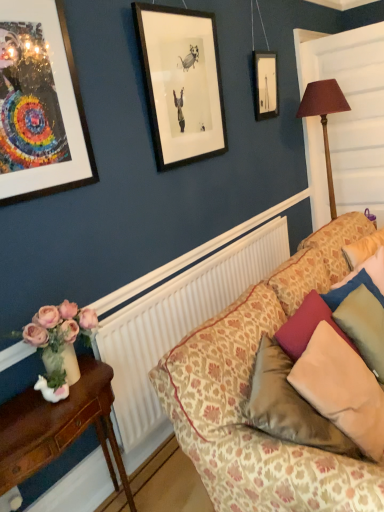
What do you see at coordinates (289, 405) in the screenshot?
I see `velvet beige pillow at lower right, arranged as the first pillow when viewed from the left` at bounding box center [289, 405].

Describe the element at coordinates (58, 426) in the screenshot. I see `brown wooden table at lower left` at that location.

At what (x,y) coordinates should I click in order to perform the action: click on metallic gold picture frame at upper left. Please return your answer as a coordinate pair (x, y). The width and height of the screenshot is (384, 512). Looking at the image, I should click on (40, 106).

The height and width of the screenshot is (512, 384). What do you see at coordinates (249, 396) in the screenshot?
I see `patterned fabric couch at lower right` at bounding box center [249, 396].

Describe the element at coordinates (178, 321) in the screenshot. The image size is (384, 512). I see `white textured radiator at center` at that location.

The height and width of the screenshot is (512, 384). In order to click on velvet green pillow at right, which is the second pillow from left to right in this screenshot , I will do `click(364, 326)`.

Is there a large distance between velvet beige pillow at lower right, the second pillow viewed from the right, and velvet green pillow at right, which is the second pillow from left to right?

Actually, velvet beige pillow at lower right, the second pillow viewed from the right, and velvet green pillow at right, which is the second pillow from left to right, are a little close together.

Looking at the image, does velvet beige pillow at lower right, the second pillow viewed from the right, seem bigger or smaller compared to velvet green pillow at right, which appears as the first pillow when viewed from the right?

Clearly, velvet beige pillow at lower right, the second pillow viewed from the right, is larger in size than velvet green pillow at right, which appears as the first pillow when viewed from the right.

Consider the image. What's the angular difference between velvet beige pillow at lower right, the second pillow viewed from the right, and velvet green pillow at right, which appears as the first pillow when viewed from the right,'s facing directions?

25.5 degrees separate the facing orientations of velvet beige pillow at lower right, the second pillow viewed from the right, and velvet green pillow at right, which appears as the first pillow when viewed from the right.

From a real-world perspective, which is physically above, velvet beige pillow at lower right, the second pillow viewed from the right, or velvet green pillow at right, which appears as the first pillow when viewed from the right?

velvet beige pillow at lower right, the second pillow viewed from the right.

Between brown fabric lampshade at right and velvet beige pillow at lower right, arranged as the first pillow when viewed from the left, which one appears on the right side from the viewer's perspective?

From the viewer's perspective, brown fabric lampshade at right appears more on the right side.

From the image's perspective, who appears lower, brown fabric lampshade at right or velvet beige pillow at lower right, the second pillow viewed from the right?

velvet beige pillow at lower right, the second pillow viewed from the right, is shown below in the image.

Is brown fabric lampshade at right further to camera compared to velvet beige pillow at lower right, arranged as the first pillow when viewed from the left?

Yes.

Is patterned fabric couch at lower right not close to brown wooden table at lower left?

No, there isn't a large distance between patterned fabric couch at lower right and brown wooden table at lower left.

Is patterned fabric couch at lower right closer to camera compared to brown wooden table at lower left?

Yes, it is in front of brown wooden table at lower left.

Which object is positioned more to the left, patterned fabric couch at lower right or brown wooden table at lower left?

brown wooden table at lower left is more to the left.

At what (x,y) coordinates should I click in order to perform the action: click on table located on the left of patterned fabric couch at lower right. Please return your answer as a coordinate pair (x, y). Looking at the image, I should click on (58, 426).

Is point (380, 485) closer or farther from the camera than point (378, 365)?

Point (380, 485) appears to be closer to the viewer than point (378, 365).

Is patterned fabric couch at lower right to the left of velvet green pillow at right, which is the second pillow from left to right, from the viewer's perspective?

Correct, you'll find patterned fabric couch at lower right to the left of velvet green pillow at right, which is the second pillow from left to right.

Does patterned fabric couch at lower right have a larger size compared to velvet green pillow at right, which appears as the first pillow when viewed from the right?

Indeed, patterned fabric couch at lower right has a larger size compared to velvet green pillow at right, which appears as the first pillow when viewed from the right.

How many degrees apart are the facing directions of patterned fabric couch at lower right and velvet green pillow at right, which is the second pillow from left to right?

There is a 0.000631-degree angle between the facing directions of patterned fabric couch at lower right and velvet green pillow at right, which is the second pillow from left to right.

Which is behind, point (193, 359) or point (264, 275)?

The point (264, 275) is farther.

Is patterned fabric couch at lower right facing towards white textured radiator at center?

Yes, patterned fabric couch at lower right faces towards white textured radiator at center.

This screenshot has width=384, height=512. In order to click on studio couch that appears below the white textured radiator at center (from the image's perspective) in this screenshot , I will do `click(249, 396)`.

Is patterned fabric couch at lower right completely or partially outside of white textured radiator at center?

patterned fabric couch at lower right lies outside white textured radiator at center's area.

From the image's perspective, which one is positioned lower, white textured radiator at center or metallic gold picture frame at upper left?

white textured radiator at center.

Considering the relative sizes of white textured radiator at center and metallic gold picture frame at upper left in the image provided, is white textured radiator at center taller than metallic gold picture frame at upper left?

Indeed, white textured radiator at center has a greater height compared to metallic gold picture frame at upper left.

Is white textured radiator at center to the left or to the right of metallic gold picture frame at upper left in the image?

Based on their positions, white textured radiator at center is located to the right of metallic gold picture frame at upper left.

Considering the sizes of objects white textured radiator at center and metallic gold picture frame at upper left in the image provided, who is smaller, white textured radiator at center or metallic gold picture frame at upper left?

Smaller between the two is metallic gold picture frame at upper left.

Consider the image. From their relative heights in the image, would you say metallic gold picture frame at upper left is taller or shorter than brown wooden table at lower left?

metallic gold picture frame at upper left is taller than brown wooden table at lower left.

Who is bigger, metallic gold picture frame at upper left or brown wooden table at lower left?

Bigger between the two is brown wooden table at lower left.

Is metallic gold picture frame at upper left positioned before brown wooden table at lower left?

No, metallic gold picture frame at upper left is further to the viewer.

You are a GUI agent. You are given a task and a screenshot of the screen. Output one action in this format:
    pyautogui.click(x=<x>, y=<y>)
    Task: Click on the table below the metallic gold picture frame at upper left (from a real-world perspective)
    The width and height of the screenshot is (384, 512).
    Given the screenshot: What is the action you would take?
    pyautogui.click(x=58, y=426)

The image size is (384, 512). Find the location of `pillow positioned vertically above the velvet green pillow at right, which appears as the first pillow when viewed from the right (from a real-world perspective)`. pillow positioned vertically above the velvet green pillow at right, which appears as the first pillow when viewed from the right (from a real-world perspective) is located at coordinates (289, 405).

Locate an element on the screen. The image size is (384, 512). the 2nd pillow positioned below the brown fabric lampshade at right (from the image's perspective) is located at coordinates (289, 405).

When comparing their distances from white textured radiator at center, does brown wooden table at lower left or patterned fabric couch at lower right seem further?

Among the two, patterned fabric couch at lower right is located further to white textured radiator at center.

Considering their positions, is white textured radiator at center positioned closer to brown fabric lampshade at right than patterned fabric couch at lower right?

white textured radiator at center.

Looking at this image, estimate the real-world distances between objects in this image. Which object is closer to velvet green pillow at right, which is the second pillow from left to right, metallic gold picture frame at upper left or patterned fabric couch at lower right?

Based on the image, patterned fabric couch at lower right appears to be nearer to velvet green pillow at right, which is the second pillow from left to right.

Which object lies nearer to the anchor point metallic gold picture frame at upper left, velvet beige pillow at lower right, arranged as the first pillow when viewed from the left, or velvet green pillow at right, which is the second pillow from left to right?

velvet beige pillow at lower right, arranged as the first pillow when viewed from the left, is closer to metallic gold picture frame at upper left.

When comparing their distances from brown fabric lampshade at right, does white textured radiator at center or velvet beige pillow at lower right, the second pillow viewed from the right, seem further?

Based on the image, velvet beige pillow at lower right, the second pillow viewed from the right, appears to be further to brown fabric lampshade at right.

Which object lies nearer to the anchor point patterned fabric couch at lower right, brown wooden table at lower left or velvet green pillow at right, which is the second pillow from left to right?

velvet green pillow at right, which is the second pillow from left to right.

Which object lies nearer to the anchor point brown wooden table at lower left, patterned fabric couch at lower right or metallic gold picture frame at upper left?

Based on the image, patterned fabric couch at lower right appears to be nearer to brown wooden table at lower left.

Estimate the real-world distances between objects in this image. Which object is closer to white textured radiator at center, brown wooden table at lower left or metallic gold picture frame at upper left?

brown wooden table at lower left lies closer to white textured radiator at center than the other object.

Where is `radiator between patterned fabric couch at lower right and brown fabric lampshade at right in the front-back direction`? radiator between patterned fabric couch at lower right and brown fabric lampshade at right in the front-back direction is located at coordinates (178, 321).

Image resolution: width=384 pixels, height=512 pixels. In order to click on table between velvet beige pillow at lower right, the second pillow viewed from the right, and brown fabric lampshade at right in the front-back direction in this screenshot , I will do pos(58,426).

Where is `studio couch located between metallic gold picture frame at upper left and velvet green pillow at right, which appears as the first pillow when viewed from the right, in the left-right direction`? This screenshot has height=512, width=384. studio couch located between metallic gold picture frame at upper left and velvet green pillow at right, which appears as the first pillow when viewed from the right, in the left-right direction is located at coordinates (249, 396).

Find the location of a particular element. This screenshot has width=384, height=512. radiator between metallic gold picture frame at upper left and velvet green pillow at right, which is the second pillow from left to right is located at coordinates (178, 321).